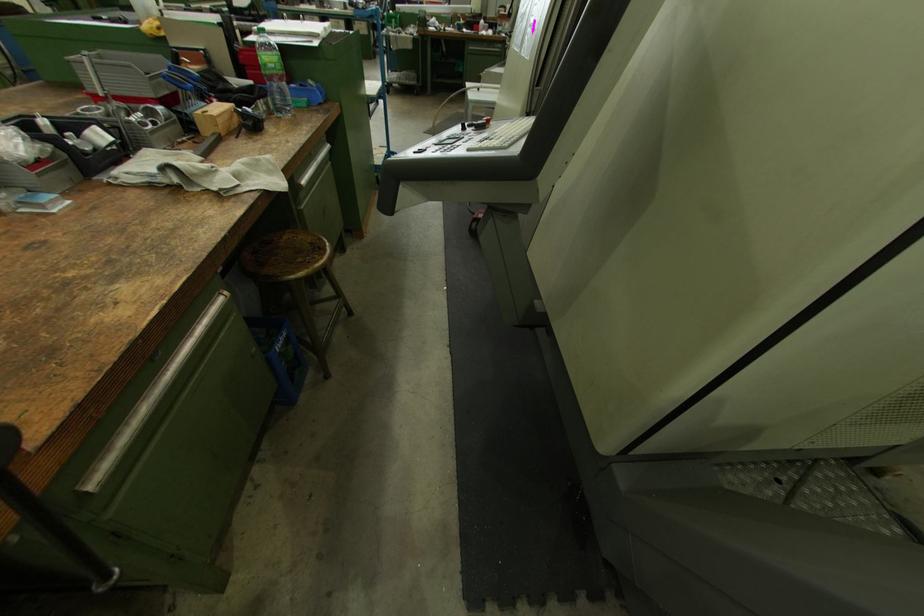
At what (x,y) coordinates should I click in order to perform the action: click on red push button. Please return your answer as a coordinate pair (x, y). This screenshot has height=616, width=924. Looking at the image, I should click on (487, 120).